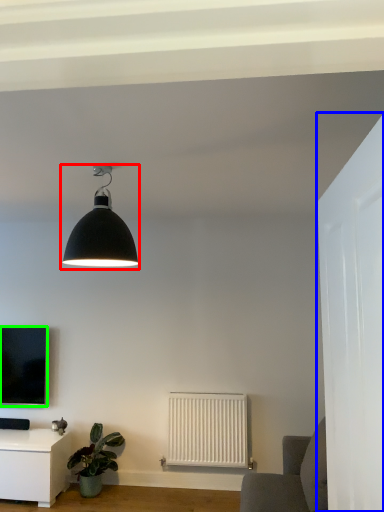
Question: Which object is the closest to the lamp (highlighted by a red box)? Choose among these: glass door (highlighted by a blue box) or television (highlighted by a green box).

Choices:
 (A) glass door
 (B) television

Answer: (A)